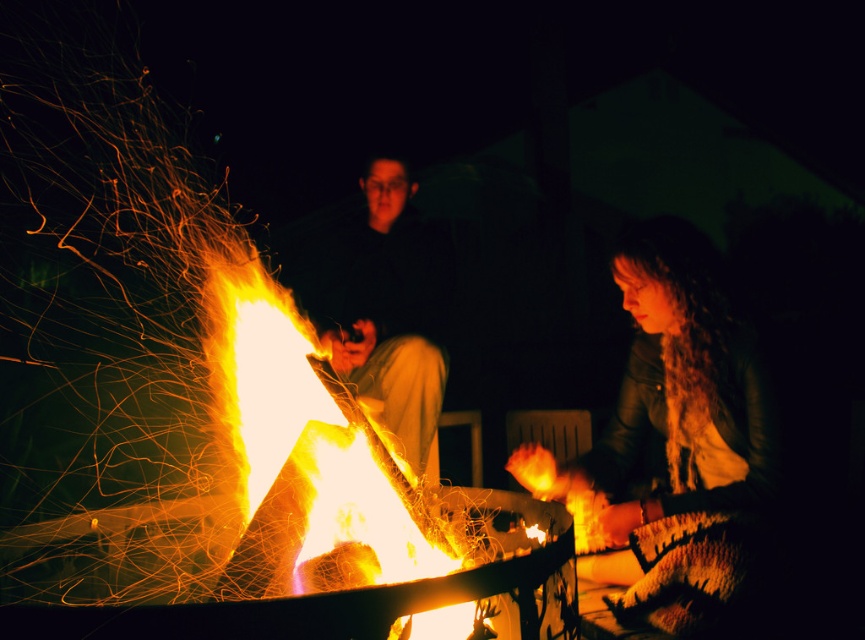
Does leather jacket at lower right lie in front of matte black jacket at center?

Yes, it is in front of matte black jacket at center.

Describe the element at coordinates (686, 442) in the screenshot. I see `leather jacket at lower right` at that location.

This screenshot has width=865, height=640. Identify the location of leather jacket at lower right. (686, 442).

Is leather jacket at lower right thinner than flaming wood at center?

No.

Can you confirm if leather jacket at lower right is bigger than flaming wood at center?

Yes, leather jacket at lower right is bigger than flaming wood at center.

What are the coordinates of `leather jacket at lower right` in the screenshot? It's located at (686, 442).

This screenshot has height=640, width=865. Find the location of `leather jacket at lower right`. leather jacket at lower right is located at coordinates (686, 442).

Does flaming wood at center appear on the left side of matte black jacket at center?

Yes, flaming wood at center is to the left of matte black jacket at center.

Does flaming wood at center come behind matte black jacket at center?

No, it is in front of matte black jacket at center.

Describe the element at coordinates (312, 477) in the screenshot. I see `flaming wood at center` at that location.

I want to click on flaming wood at center, so click(312, 477).